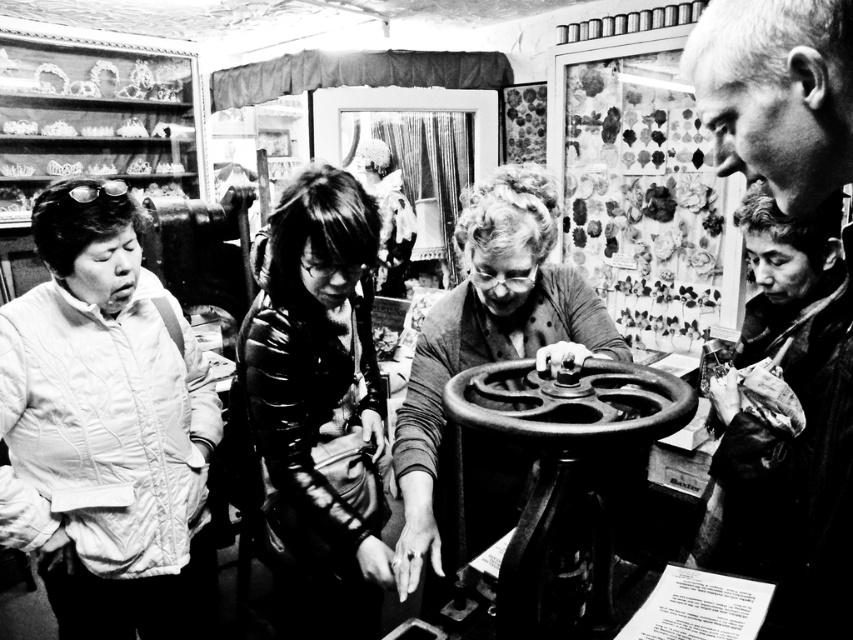
Question: Is smooth black sewing machine at center positioned in front of metallic gear at center?

Choices:
 (A) no
 (B) yes

Answer: (A)

Question: Among these points, which one is nearest to the camera?

Choices:
 (A) (416, 397)
 (B) (717, 138)
 (C) (576, 381)

Answer: (B)

Question: Is glossy black jacket at center bigger than smooth gray hair at upper right?

Choices:
 (A) no
 (B) yes

Answer: (A)

Question: Which object is farther from the camera taking this photo?

Choices:
 (A) smooth black sewing machine at center
 (B) smooth gray hair at upper right
 (C) glossy black jacket at center

Answer: (C)

Question: Which point is closer to the camera taking this photo?

Choices:
 (A) (28, 532)
 (B) (428, 388)
 (C) (357, 316)

Answer: (A)

Question: Is quilted white jacket at left thinner than glossy black jacket at center?

Choices:
 (A) no
 (B) yes

Answer: (A)